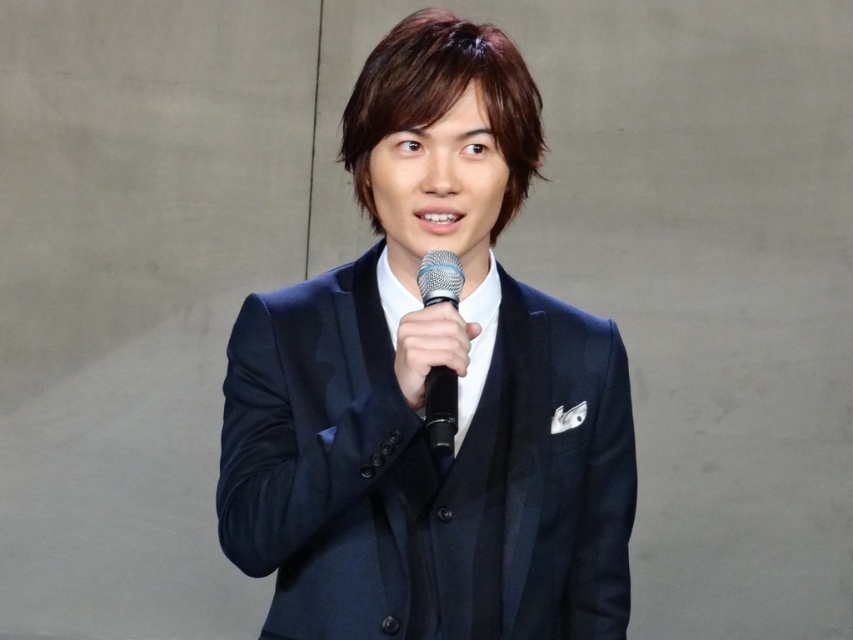
Question: Among these points, which one is nearest to the camera?

Choices:
 (A) (445, 404)
 (B) (460, 326)

Answer: (A)

Question: Which object appears farthest from the camera in this image?

Choices:
 (A) navy blue suit at center
 (B) black matte microphone at center

Answer: (A)

Question: Does navy blue suit at center appear over black matte microphone at center?

Choices:
 (A) no
 (B) yes

Answer: (B)

Question: Observing the image, what is the correct spatial positioning of navy blue suit at center in reference to black matte microphone at center?

Choices:
 (A) left
 (B) right

Answer: (B)

Question: Does navy blue suit at center lie in front of black matte microphone at center?

Choices:
 (A) yes
 (B) no

Answer: (B)